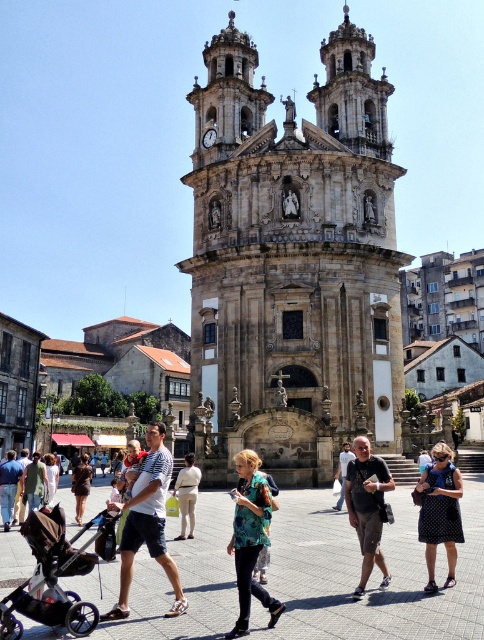
You are a photographer standing in the square and want to capture both the denim shorts at center and the green cotton shirt at center in a single photo. Which object should you focus on first to ensure both are in frame?

The denim shorts at center is taller than the green cotton shirt at center, so you should focus on the denim shorts at center first to ensure both are in frame.

You are standing in the square and see the denim shorts at center and the green cotton shirt at center. Which one is closer to you?

The denim shorts at center is closer to you since it is in front of the green cotton shirt at center.

You are a photographer standing in the square and want to capture both the polka dot dress at center and the denim shorts at center in a single shot. Which clothing item is covering the other in the photo?

The polka dot dress at center is positioned over denim shorts at center, so the polka dot dress at center is covering the denim shorts at center in the photo.